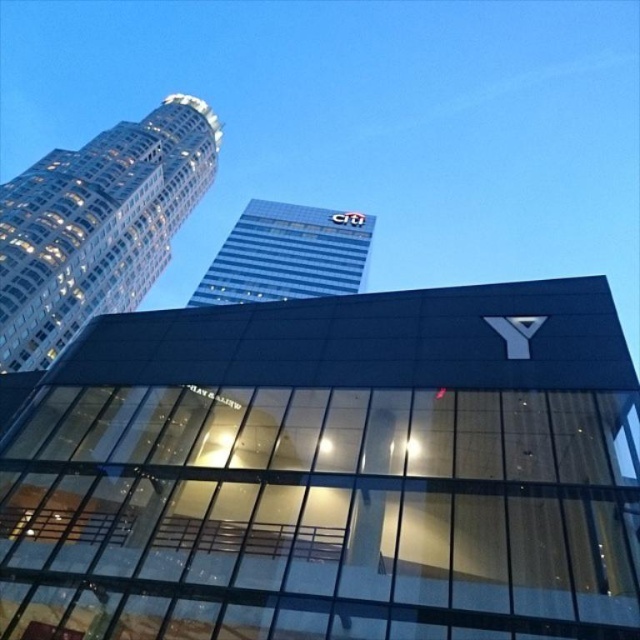
Is white glass skyscraper at upper left positioned before blue glass building at upper center?

That is True.

Looking at this image, does white glass skyscraper at upper left have a greater height compared to blue glass building at upper center?

Indeed, white glass skyscraper at upper left has a greater height compared to blue glass building at upper center.

The image size is (640, 640). Describe the element at coordinates (97, 225) in the screenshot. I see `white glass skyscraper at upper left` at that location.

Where is `white glass skyscraper at upper left`? The height and width of the screenshot is (640, 640). white glass skyscraper at upper left is located at coordinates (97, 225).